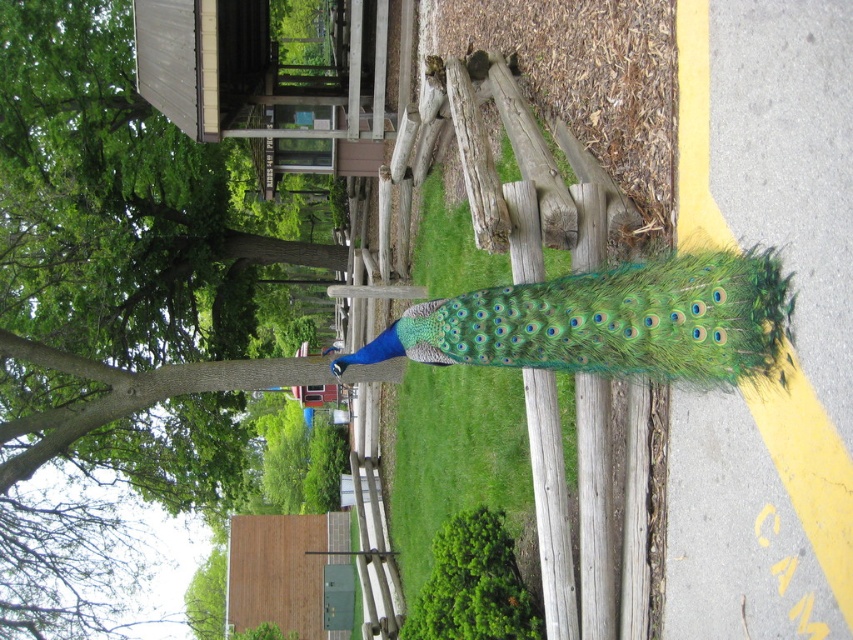
Is green leafy grass at center smaller than green iridescent feathers at center?

No, green leafy grass at center is not smaller than green iridescent feathers at center.

Identify the location of green leafy grass at center. (531, 484).

Is green leafy tree at center to the right of green iridescent feathers at center from the viewer's perspective?

No, green leafy tree at center is not to the right of green iridescent feathers at center.

Is green leafy tree at center wider than green iridescent feathers at center?

Indeed, green leafy tree at center has a greater width compared to green iridescent feathers at center.

Is point (292, 243) positioned before point (764, 275)?

No, (292, 243) is further to viewer.

Find the location of a particular element. The image size is (853, 640). green leafy tree at center is located at coordinates (120, 208).

Is the position of green leafy tree at center less distant than that of green leafy grass at center?

No.

How far apart are green leafy tree at center and green leafy grass at center?

The distance of green leafy tree at center from green leafy grass at center is 18.76 feet.

Image resolution: width=853 pixels, height=640 pixels. In order to click on green leafy tree at center in this screenshot , I will do `click(120, 208)`.